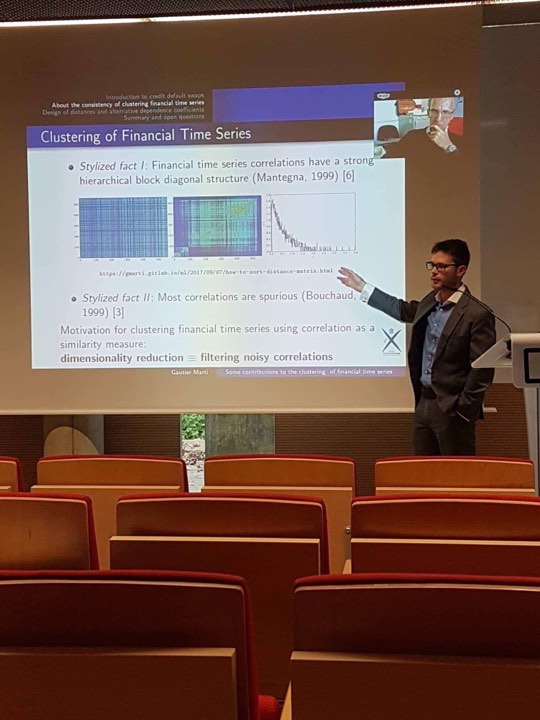
I want to click on seat, so click(x=271, y=479), click(x=408, y=472), click(x=408, y=518), click(x=264, y=513), click(x=49, y=518), click(x=84, y=477), click(x=6, y=472), click(x=129, y=620), click(x=349, y=616).